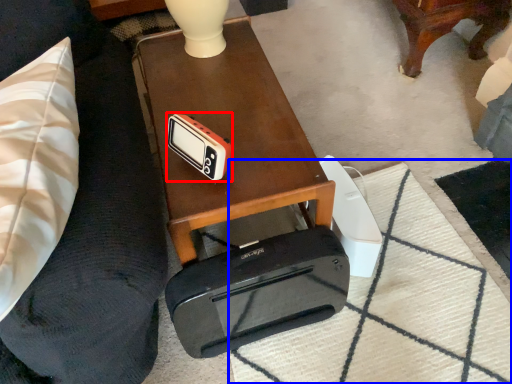
Question: Which of the following is the closest to the observer, gadget (highlighted by a red box) or mat (highlighted by a blue box)?

Choices:
 (A) gadget
 (B) mat

Answer: (A)